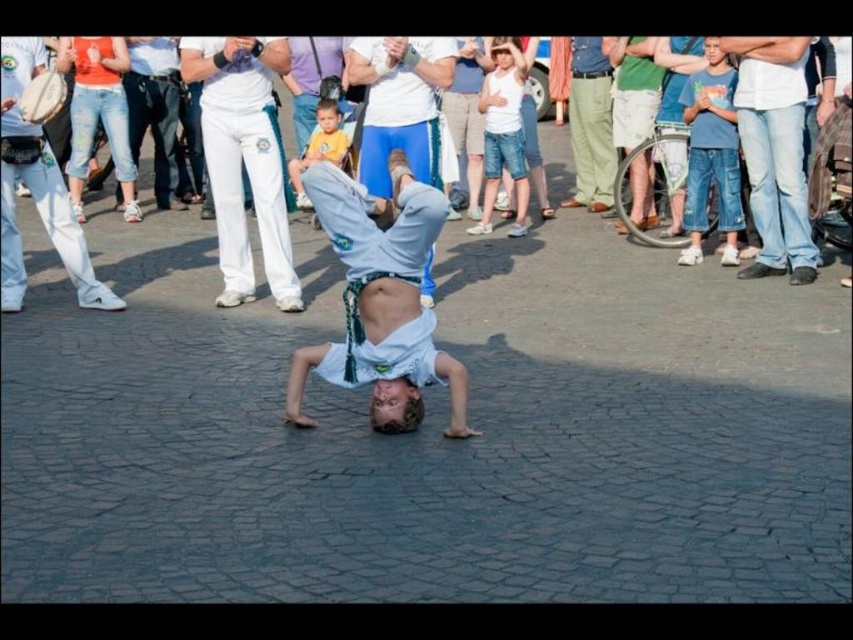
Question: Considering the real-world distances, which object is closest to the white cotton shirt at center?

Choices:
 (A) yellow cotton shirt at center
 (B) white cotton pants at center
 (C) white fabric shirt at center

Answer: (C)

Question: Is white fabric shirt at center above blue jeans at right?

Choices:
 (A) no
 (B) yes

Answer: (B)

Question: Which object is farther from the camera taking this photo?

Choices:
 (A) yellow cotton shirt at center
 (B) jeans at right

Answer: (A)

Question: Does white fabric shirt at center appear on the right side of yellow cotton shirt at center?

Choices:
 (A) no
 (B) yes

Answer: (B)

Question: Does white fabric shirt at center have a greater width compared to blue jeans at right?

Choices:
 (A) no
 (B) yes

Answer: (B)

Question: Which of the following is the closest to the observer?

Choices:
 (A) yellow cotton shirt at center
 (B) white cotton pants at upper center
 (C) white cotton shirt at center
 (D) white cotton pants at center

Answer: (C)